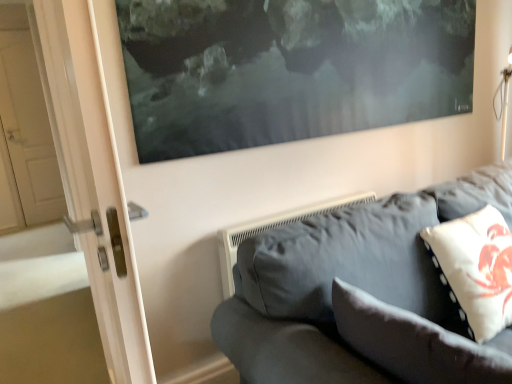
Question: From the image's perspective, would you say white fabric pillow at lower right, which ranks as the 2th pillow in right-to-left order, is positioned over dark gray fabric couch at lower right?

Choices:
 (A) yes
 (B) no

Answer: (B)

Question: Considering the relative sizes of white fabric pillow at lower right, marked as the first pillow in a left-to-right arrangement, and dark gray fabric couch at lower right in the image provided, is white fabric pillow at lower right, marked as the first pillow in a left-to-right arrangement, smaller than dark gray fabric couch at lower right?

Choices:
 (A) no
 (B) yes

Answer: (B)

Question: Is dark gray fabric couch at lower right surrounded by white fabric pillow at lower right, which ranks as the 2th pillow in right-to-left order?

Choices:
 (A) no
 (B) yes

Answer: (A)

Question: Are white fabric pillow at lower right, marked as the first pillow in a left-to-right arrangement, and dark gray fabric couch at lower right beside each other?

Choices:
 (A) yes
 (B) no

Answer: (B)

Question: Is white fabric pillow at lower right, marked as the first pillow in a left-to-right arrangement, at the right side of dark gray fabric couch at lower right?

Choices:
 (A) yes
 (B) no

Answer: (B)

Question: In the image, is dark gray fabric couch at lower right positioned in front of or behind white fabric pillow at lower right, which ranks as the 2th pillow in right-to-left order?

Choices:
 (A) front
 (B) behind

Answer: (A)

Question: Looking at the image, does dark gray fabric couch at lower right seem bigger or smaller compared to white fabric pillow at lower right, which ranks as the 2th pillow in right-to-left order?

Choices:
 (A) small
 (B) big

Answer: (B)

Question: Would you say dark gray fabric couch at lower right is inside or outside white fabric pillow at lower right, marked as the first pillow in a left-to-right arrangement?

Choices:
 (A) inside
 (B) outside

Answer: (B)

Question: Visually, is dark gray fabric couch at lower right positioned to the left or to the right of white fabric pillow at lower right, marked as the first pillow in a left-to-right arrangement?

Choices:
 (A) right
 (B) left

Answer: (A)

Question: Is dark gray fabric couch at lower right taller or shorter than white dotted fabric pillow at right, the 1th pillow in the right-to-left sequence?

Choices:
 (A) tall
 (B) short

Answer: (A)

Question: From the image's perspective, relative to white dotted fabric pillow at right, the 1th pillow in the right-to-left sequence, is dark gray fabric couch at lower right above or below?

Choices:
 (A) above
 (B) below

Answer: (B)

Question: Is point tap(394, 231) positioned closer to the camera than point tap(500, 321)?

Choices:
 (A) farther
 (B) closer

Answer: (A)

Question: Is dark gray fabric couch at lower right bigger or smaller than white dotted fabric pillow at right, marked as the 2th pillow in a left-to-right arrangement?

Choices:
 (A) big
 (B) small

Answer: (A)

Question: From their relative heights in the image, would you say white fabric pillow at lower right, marked as the first pillow in a left-to-right arrangement, is taller or shorter than white dotted fabric pillow at right, marked as the 2th pillow in a left-to-right arrangement?

Choices:
 (A) short
 (B) tall

Answer: (A)

Question: From a real-world perspective, is white fabric pillow at lower right, which ranks as the 2th pillow in right-to-left order, above or below white dotted fabric pillow at right, the 1th pillow in the right-to-left sequence?

Choices:
 (A) above
 (B) below

Answer: (B)